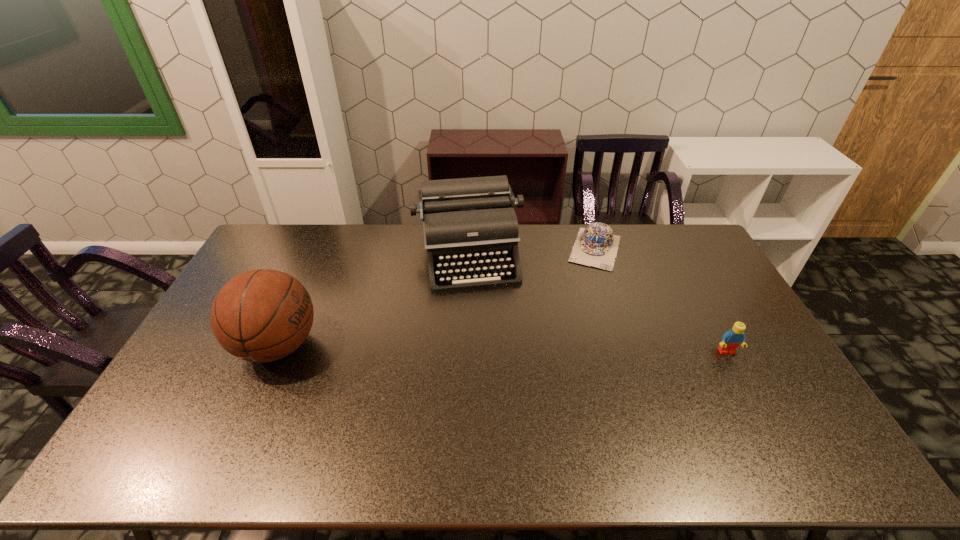
Identify which object is located as the second nearest to the rightmost object. Please provide its 2D coordinates. Your answer should be formatted as a tuple, i.e. [(x, y)], where the tuple contains the x and y coordinates of a point satisfying the conditions above.

[(470, 225)]

Identify which object is the nearest to the cap. Please provide its 2D coordinates. Your answer should be formatted as a tuple, i.e. [(x, y)], where the tuple contains the x and y coordinates of a point satisfying the conditions above.

[(470, 225)]